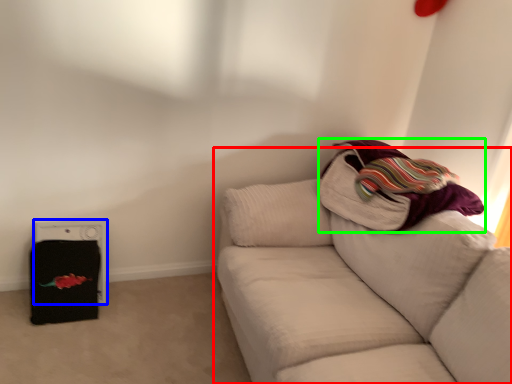
Question: Estimate the real-world distances between objects in this image. Which object is closer to studio couch (highlighted by a red box), appliance (highlighted by a blue box) or blanket (highlighted by a green box)?

Choices:
 (A) appliance
 (B) blanket

Answer: (B)